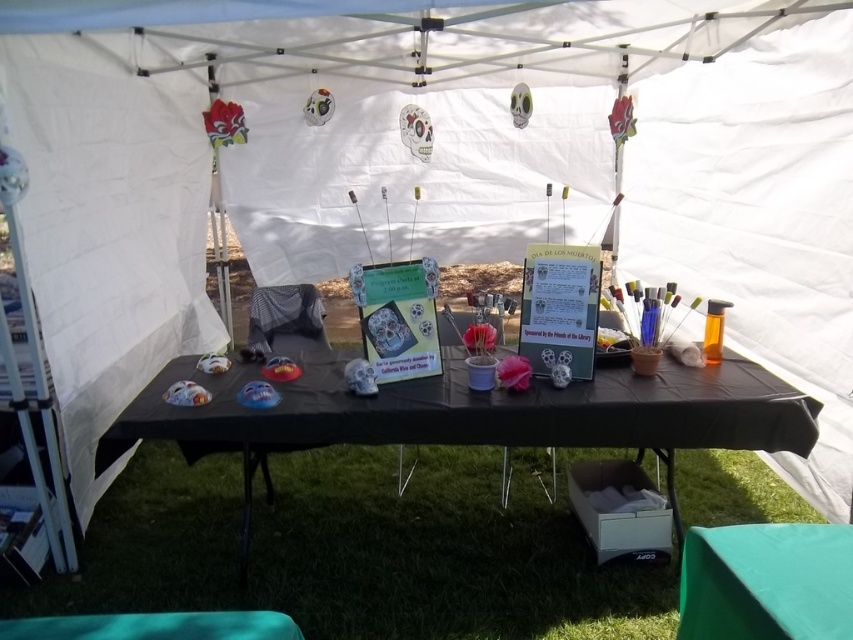
You are a person with a 60 cm long walking stick. You want to place your walking stick between the green grass at lower center and the black matte picnic table at center. Can the walking stick fit entirely within that space?

The distance between the green grass at lower center and the black matte picnic table at center is 61.77 centimeters. Since the walking stick is 60 cm long, it can fit entirely within the space between them.

You are standing at the edge of the table looking towards the center. Which of the two points, point (645,632) or point (445,412), is closer to you?

Point (645,632) is closer to you because it is further to the viewer than point (445,412).